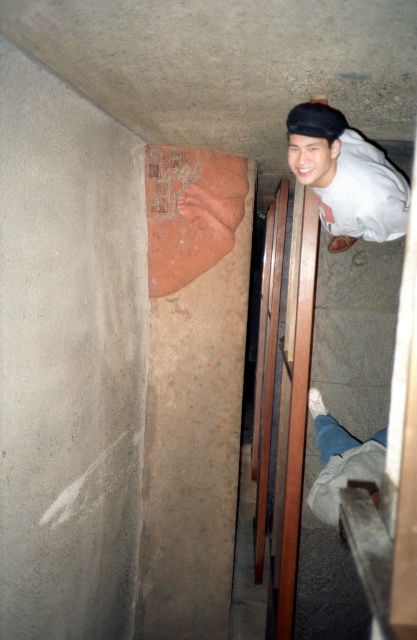
Question: Based on their relative distances, which object is nearer to the white matte shirt at upper right?

Choices:
 (A) white cotton pants at lower right
 (B) black matte baseball hat at upper center

Answer: (B)

Question: Estimate the real-world distances between objects in this image. Which object is farther from the black matte baseball hat at upper center?

Choices:
 (A) white matte shirt at upper right
 (B) white cotton pants at lower right

Answer: (B)

Question: Which point is farther to the camera?

Choices:
 (A) white cotton pants at lower right
 (B) white matte shirt at upper right
 (C) black matte baseball hat at upper center

Answer: (A)

Question: Is white matte shirt at upper right further to camera compared to black matte baseball hat at upper center?

Choices:
 (A) yes
 (B) no

Answer: (A)

Question: Is white cotton pants at lower right smaller than black matte baseball hat at upper center?

Choices:
 (A) yes
 (B) no

Answer: (B)

Question: Can you confirm if white matte shirt at upper right is positioned below black matte baseball hat at upper center?

Choices:
 (A) no
 (B) yes

Answer: (B)